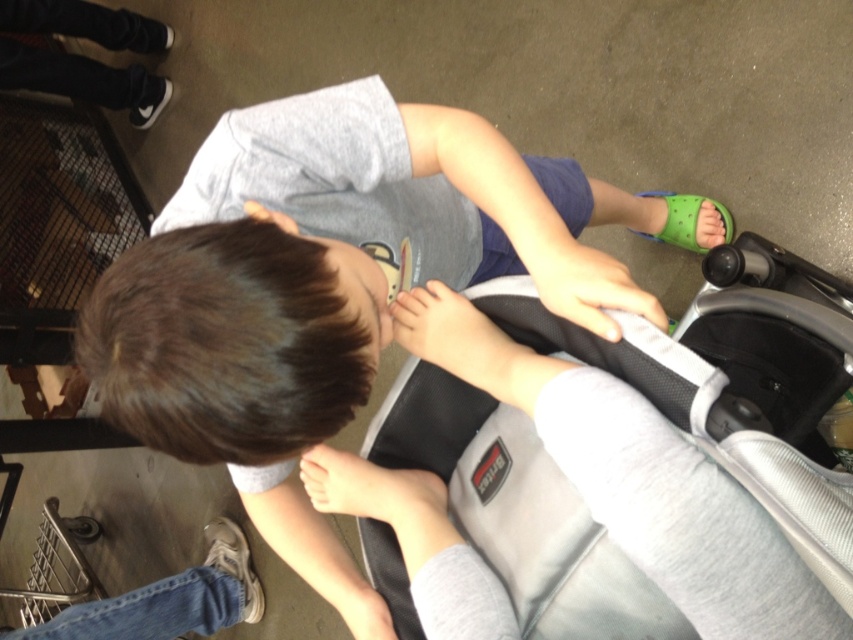
Can you confirm if gray mesh baby carriage at center is bigger than gray fabric shirt at center?

No.

Can you confirm if gray mesh baby carriage at center is shorter than gray fabric shirt at center?

Indeed, gray mesh baby carriage at center has a lesser height compared to gray fabric shirt at center.

Who is more distant from viewer, (x=616, y=460) or (x=283, y=102)?

The point (x=283, y=102) is more distant.

At what (x,y) coordinates should I click in order to perform the action: click on gray mesh baby carriage at center. Please return your answer as a coordinate pair (x, y). The image size is (853, 640). Looking at the image, I should click on (584, 490).